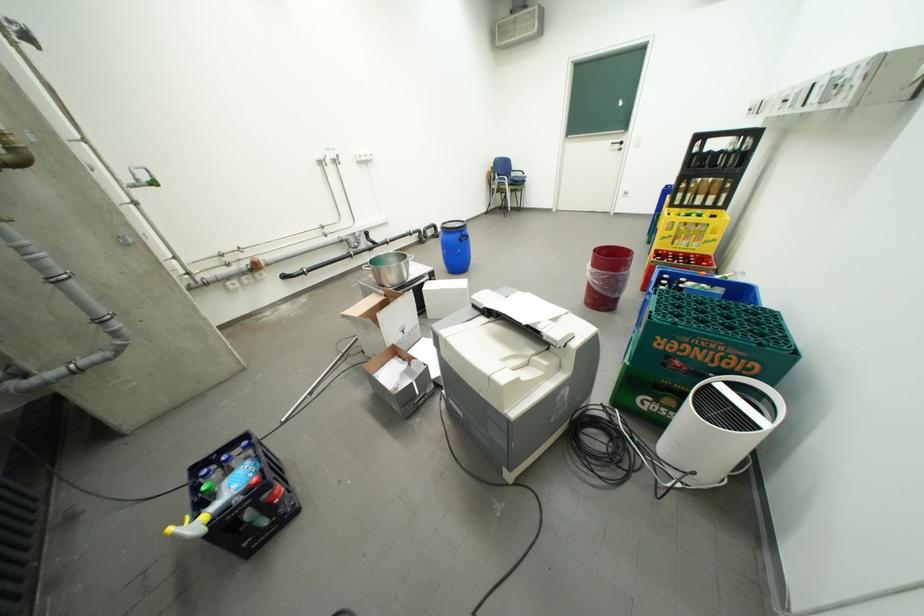
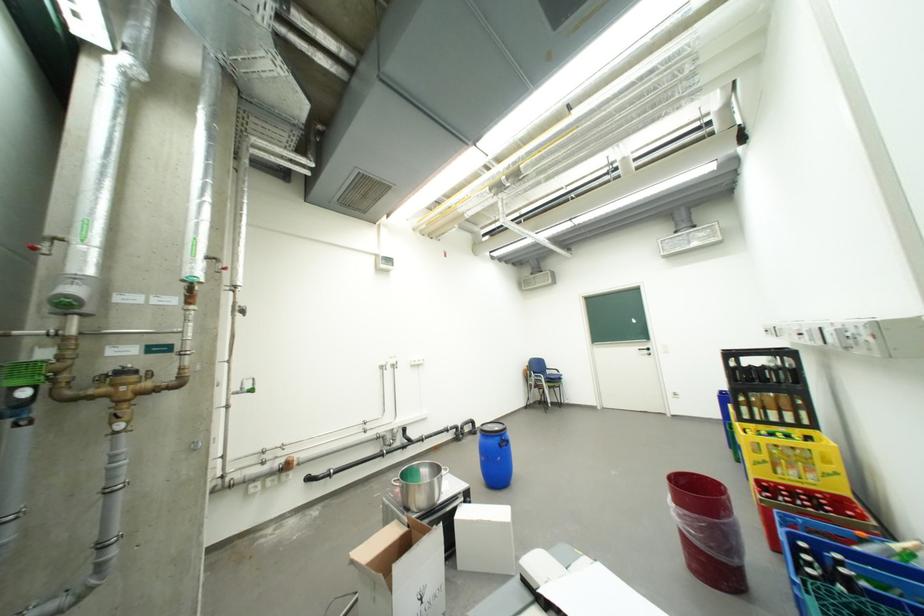
Question: The images are taken continuously from a first-person perspective. In which direction is your viewpoint rotating?

Choices:
 (A) Left
 (B) Right
 (C) Up
 (D) Down

Answer: (C)